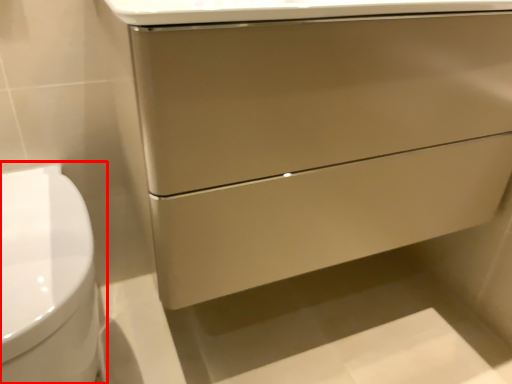
Question: From the image's perspective, where is toilet (annotated by the red box) located relative to drawer?

Choices:
 (A) below
 (B) above

Answer: (A)